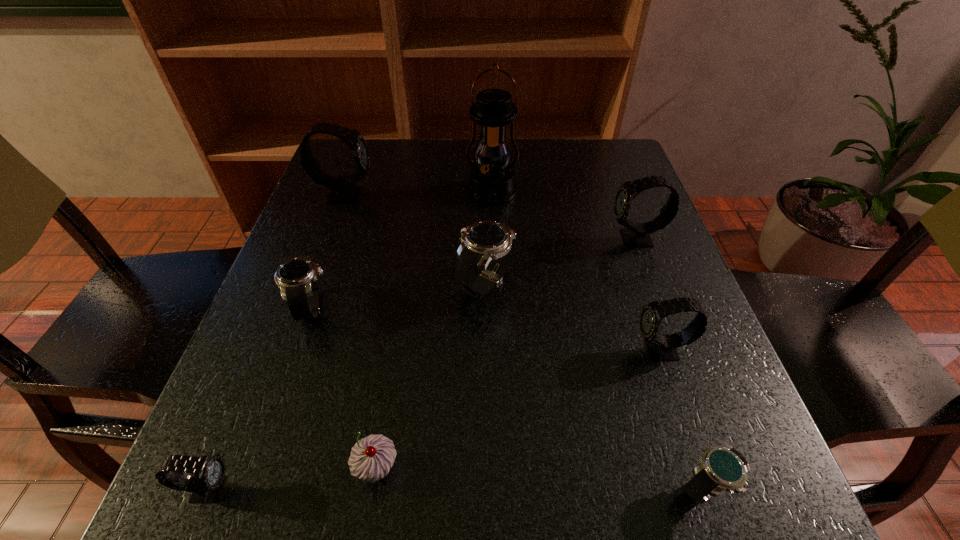
Where is `watch located at the far edge`? The width and height of the screenshot is (960, 540). watch located at the far edge is located at coordinates (343, 191).

Where is `cupcake at the near edge`? The width and height of the screenshot is (960, 540). cupcake at the near edge is located at coordinates point(372,457).

Where is `object located at the far left corner`? object located at the far left corner is located at coordinates (343, 191).

Locate an element on the screen. This screenshot has width=960, height=540. object present at the near left corner is located at coordinates (205, 485).

Identify the location of object that is at the near right corner. The width and height of the screenshot is (960, 540). (725, 468).

This screenshot has height=540, width=960. What are the coordinates of `free point at the far edge` in the screenshot? It's located at (533, 161).

Identify the location of vacant space at the near edge of the desktop. (537, 466).

This screenshot has width=960, height=540. In the image, there is a desktop. Find the location of `free space at the left edge`. free space at the left edge is located at coordinates (301, 411).

The width and height of the screenshot is (960, 540). In order to click on vacant space at the right edge of the desktop in this screenshot , I will do `click(709, 368)`.

Find the location of a particular element. vacant region at the far left corner of the desktop is located at coordinates (371, 171).